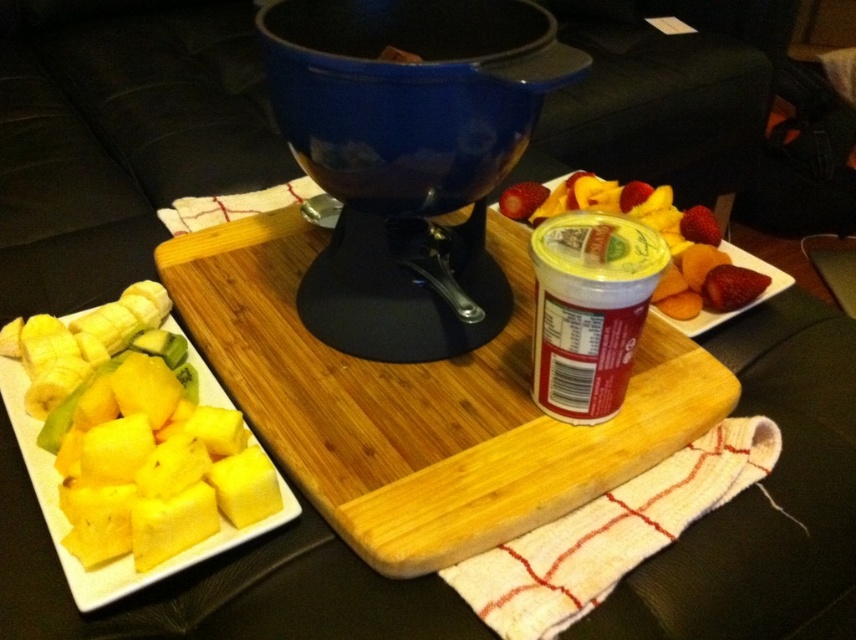
Does wooden cutting board at center appear on the right side of yellow matte pineapple at center?

Incorrect, wooden cutting board at center is not on the right side of yellow matte pineapple at center.

Find the location of a particular element. The width and height of the screenshot is (856, 640). wooden cutting board at center is located at coordinates (421, 403).

Which is behind, point (189, 252) or point (681, 252)?

The point (189, 252) is behind.

Identify the location of wooden cutting board at center. The width and height of the screenshot is (856, 640). (421, 403).

From the picture: Between yellow matte pineapple at center and red matte strawberry at center, which one is positioned lower?

yellow matte pineapple at center

Who is taller, yellow matte pineapple at center or red matte strawberry at center?

Standing taller between the two is yellow matte pineapple at center.

In order to click on yellow matte pineapple at center in this screenshot , I will do `click(697, 262)`.

Is yellow matte pineapple at center shorter than yellow matte pineapple at lower left?

Incorrect, yellow matte pineapple at center's height does not fall short of yellow matte pineapple at lower left's.

Who is more forward, (676,227) or (108,602)?

Point (108,602) is more forward.

At what (x,y) coordinates should I click in order to perform the action: click on yellow matte pineapple at center. Please return your answer as a coordinate pair (x, y). This screenshot has height=640, width=856. Looking at the image, I should click on (697, 262).